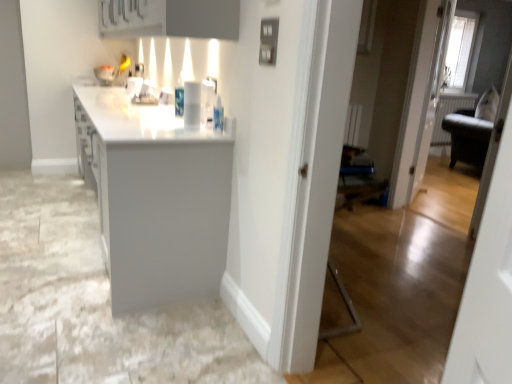
Question: From a real-world perspective, is white glossy countertop at center on top of matte gray cabinet at upper center?

Choices:
 (A) no
 (B) yes

Answer: (A)

Question: Is white glossy countertop at center smaller than matte gray cabinet at upper center?

Choices:
 (A) yes
 (B) no

Answer: (B)

Question: From the image's perspective, would you say white glossy countertop at center is shown under matte gray cabinet at upper center?

Choices:
 (A) yes
 (B) no

Answer: (A)

Question: Considering the relative sizes of white glossy countertop at center and matte gray cabinet at upper center in the image provided, is white glossy countertop at center bigger than matte gray cabinet at upper center?

Choices:
 (A) yes
 (B) no

Answer: (A)

Question: Is matte gray cabinet at upper center at the back of white glossy countertop at center?

Choices:
 (A) yes
 (B) no

Answer: (B)

Question: Is white glossy countertop at center outside matte gray cabinet at upper center?

Choices:
 (A) no
 (B) yes

Answer: (B)

Question: Is white glossy countertop at center completely or partially inside matte gray cabinet at upper center?

Choices:
 (A) no
 (B) yes

Answer: (A)

Question: From a real-world perspective, is matte gray cabinet at upper center on white glossy countertop at center?

Choices:
 (A) yes
 (B) no

Answer: (A)

Question: From the image's perspective, is matte gray cabinet at upper center located beneath white glossy countertop at center?

Choices:
 (A) no
 (B) yes

Answer: (A)

Question: Is matte gray cabinet at upper center looking in the opposite direction of white glossy countertop at center?

Choices:
 (A) no
 (B) yes

Answer: (A)

Question: Is matte gray cabinet at upper center positioned in front of white glossy countertop at center?

Choices:
 (A) no
 (B) yes

Answer: (B)

Question: From the image's perspective, is matte gray cabinet at upper center above white glossy countertop at center?

Choices:
 (A) yes
 (B) no

Answer: (A)

Question: Can we say white glossy cup at center lies outside matte gray cabinet at upper center?

Choices:
 (A) yes
 (B) no

Answer: (A)